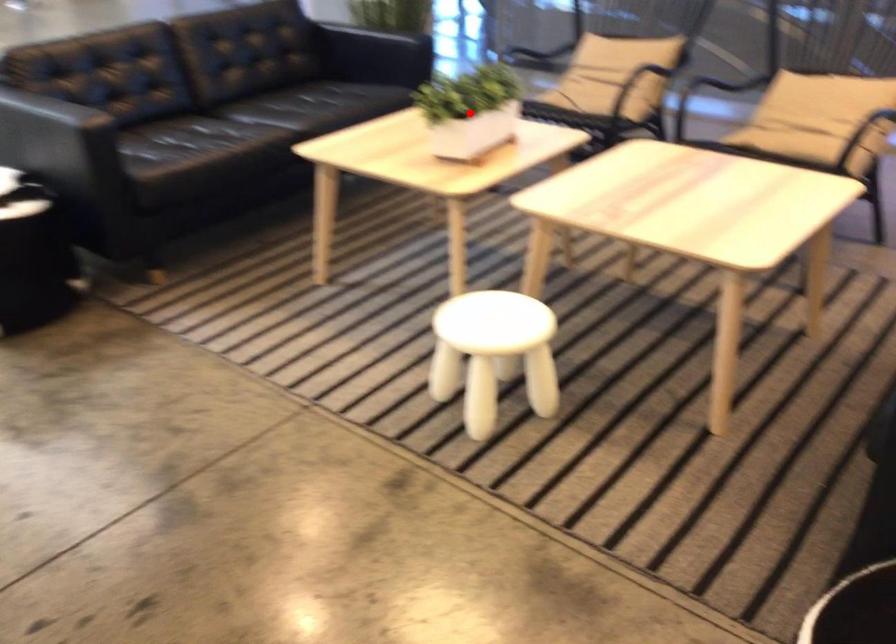
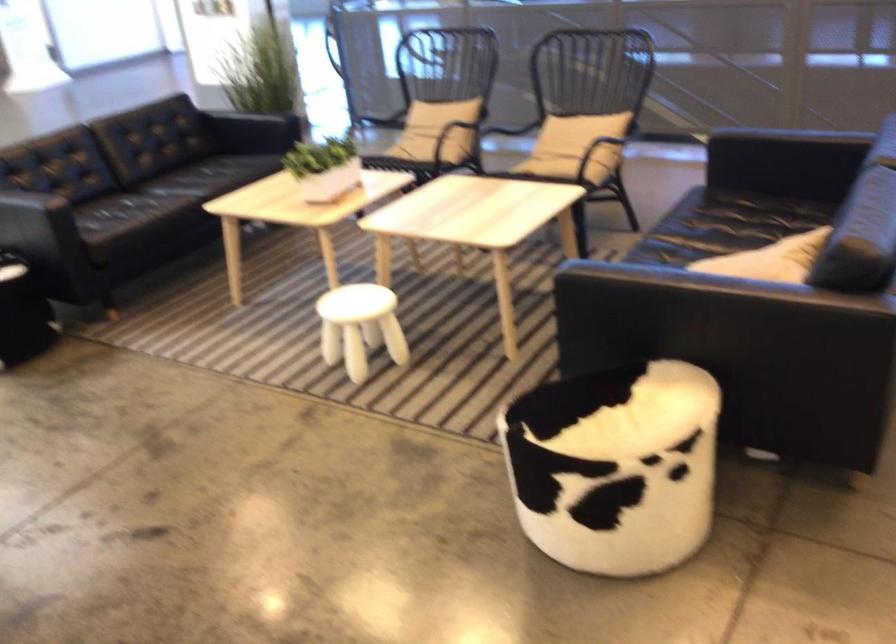
The point at the highlighted location is marked in the first image. Where is the corresponding point in the second image?

(323, 167)